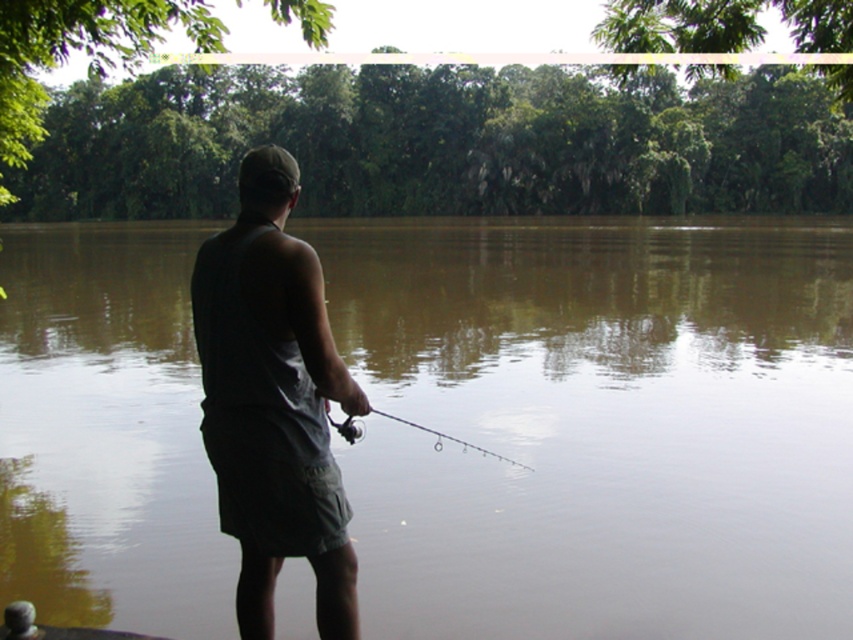
You are a drone operator trying to capture a photo of the person fishing. The camera is currently pointed at point (599, 422). Is the camera pointing at the person fishing?

The point (599, 422) corresponds to brown murky water at center, so the camera is not pointing at the person fishing.

You are standing on the dock and want to place two buoys at the coordinates point (x=317, y=524) and point (x=389, y=417). Which buoy will appear closer to you when viewed from your current position on the dock?

The buoy placed at point (x=317, y=524) will appear closer to you because it is closer to the viewer than point (x=389, y=417).